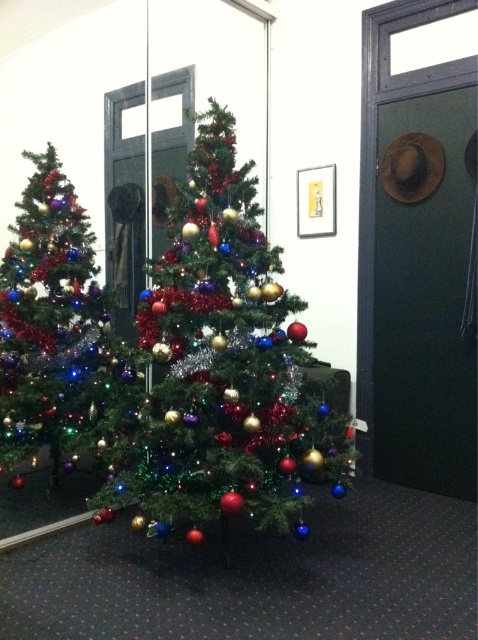
Can you confirm if shiny green christmas tree at center is thinner than shiny tinsel christmas tree at left?

No.

Can you confirm if shiny green christmas tree at center is wider than shiny tinsel christmas tree at left?

Correct, the width of shiny green christmas tree at center exceeds that of shiny tinsel christmas tree at left.

Describe the element at coordinates (221, 365) in the screenshot. The image size is (478, 640). I see `shiny green christmas tree at center` at that location.

The width and height of the screenshot is (478, 640). I want to click on shiny green christmas tree at center, so coord(221,365).